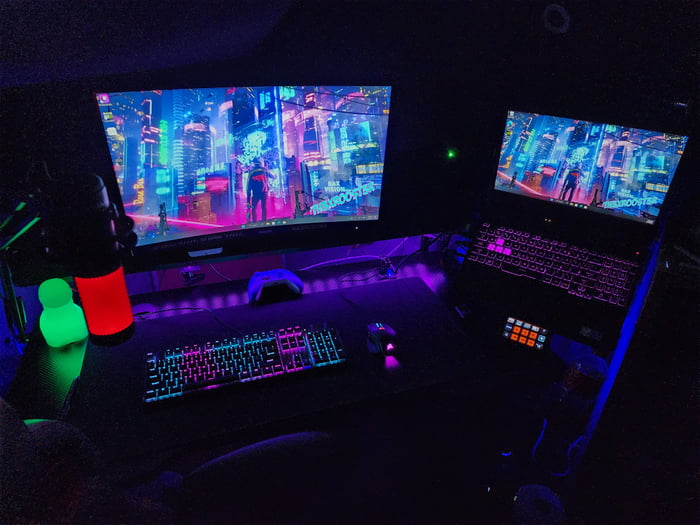
This screenshot has width=700, height=525. I want to click on laptop, so click(x=640, y=178).